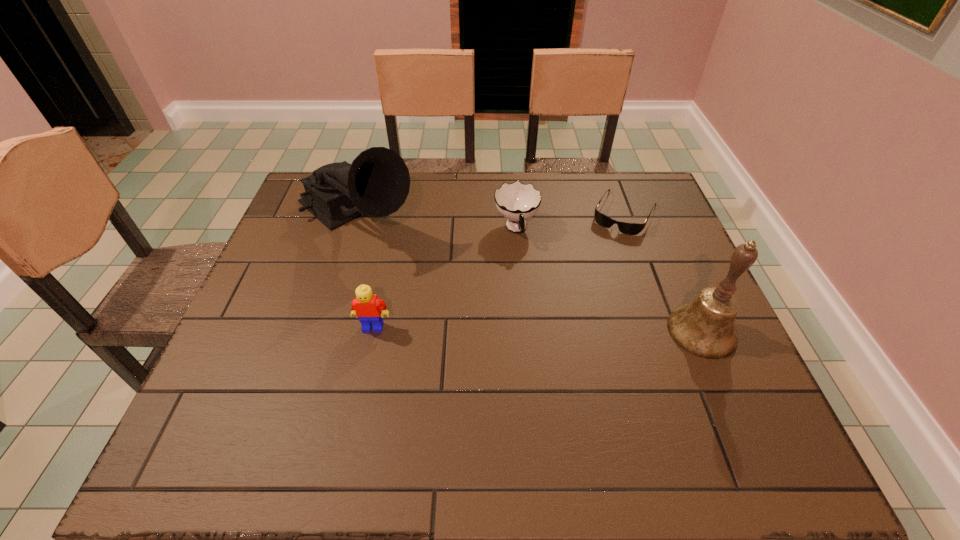
Where is `vacant space on the desktop that is between the Lego and the bell and is positioned on the side of the cup with the handle`? This screenshot has height=540, width=960. vacant space on the desktop that is between the Lego and the bell and is positioned on the side of the cup with the handle is located at coordinates (541, 329).

Identify the location of vacant space on the desktop that is between the third shortest object and the bell and is positioned from the horn of the phonograph_record. The width and height of the screenshot is (960, 540). (491, 328).

This screenshot has width=960, height=540. Find the location of `free space on the desktop that is between the Lego and the bell and is positioned on the front-facing side of the sunglasses`. free space on the desktop that is between the Lego and the bell and is positioned on the front-facing side of the sunglasses is located at coordinates (562, 329).